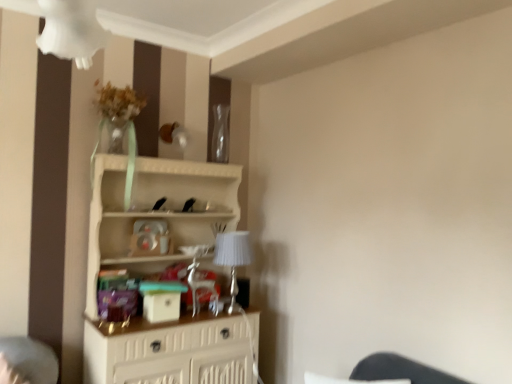
Image resolution: width=512 pixels, height=384 pixels. What are the coordinates of `transparent glass vase at upper center` in the screenshot? It's located at pos(220,134).

Where is `silver metallic table lamp at center`? Image resolution: width=512 pixels, height=384 pixels. silver metallic table lamp at center is located at coordinates (233, 258).

Find the location of a particular element. Image resolution: width=512 pixels, height=384 pixels. white wood shelf at center is located at coordinates (155, 212).

Is silver metallic table lamp at center placed right next to white wood shelf at center?

There is a gap between silver metallic table lamp at center and white wood shelf at center.

How many degrees apart are the facing directions of silver metallic table lamp at center and white wood shelf at center?

The angle between the facing direction of silver metallic table lamp at center and the facing direction of white wood shelf at center is 0.000939 degrees.

Looking at this image, from the image's perspective, which one is positioned lower, silver metallic table lamp at center or white wood shelf at center?

white wood shelf at center, from the image's perspective.

From a real-world perspective, is silver metallic table lamp at center on top of white wood shelf at center?

Yes, from a real-world perspective, silver metallic table lamp at center is above white wood shelf at center.

Does transparent glass vase at upper center appear on the left side of white wood shelf at center?

No.

Are transparent glass vase at upper center and white wood shelf at center making contact?

No, transparent glass vase at upper center is not with white wood shelf at center.

Does point (221, 121) come behind point (182, 173)?

Yes, point (221, 121) is behind point (182, 173).

From the image's perspective, is transparent glass vase at upper center located above or below white wood shelf at center?

Clearly, from the image's perspective, transparent glass vase at upper center is above white wood shelf at center.

Looking at this image, is white wood shelf at center touching transparent glass vase at upper center?

No, white wood shelf at center is not beside transparent glass vase at upper center.

Is white wood shelf at center positioned with its back to transparent glass vase at upper center?

No.

Considering the points (111, 242) and (227, 132), which point is in front, point (111, 242) or point (227, 132)?

The point (111, 242) is in front.

Which of these two, silver metallic table lamp at center or transparent glass vase at upper center, is smaller?

transparent glass vase at upper center.

Could you tell me if silver metallic table lamp at center is facing transparent glass vase at upper center?

No, silver metallic table lamp at center is not oriented towards transparent glass vase at upper center.

Is silver metallic table lamp at center surrounding transparent glass vase at upper center?

That's incorrect, transparent glass vase at upper center is not inside silver metallic table lamp at center.

In the scene shown: Does silver metallic table lamp at center appear on the right side of transparent glass vase at upper center?

Indeed, silver metallic table lamp at center is positioned on the right side of transparent glass vase at upper center.

In the scene shown: Visually, is white wood shelf at center positioned to the left or to the right of silver metallic table lamp at center?

white wood shelf at center is positioned on silver metallic table lamp at center's left side.

Does point (93, 191) come behind point (230, 242)?

No.

Is white wood shelf at center not near silver metallic table lamp at center?

No, white wood shelf at center is in close proximity to silver metallic table lamp at center.

Looking at this image, considering the relative sizes of white wood shelf at center and silver metallic table lamp at center in the image provided, is white wood shelf at center shorter than silver metallic table lamp at center?

In fact, white wood shelf at center may be taller than silver metallic table lamp at center.

In terms of height, does transparent glass vase at upper center look taller or shorter compared to silver metallic table lamp at center?

In the image, transparent glass vase at upper center appears to be shorter than silver metallic table lamp at center.

From the image's perspective, which object appears higher, transparent glass vase at upper center or silver metallic table lamp at center?

transparent glass vase at upper center appears higher in the image.

From a real-world perspective, which is physically above, transparent glass vase at upper center or silver metallic table lamp at center?

transparent glass vase at upper center, from a real-world perspective.

Measure the distance between transparent glass vase at upper center and silver metallic table lamp at center.

transparent glass vase at upper center and silver metallic table lamp at center are 79.70 centimeters apart.

The image size is (512, 384). I want to click on table lamp behind the white wood shelf at center, so click(x=233, y=258).

In the image, there is a transparent glass vase at upper center. At what (x,y) coordinates should I click in order to perform the action: click on shelf below it (from a real-world perspective). Please return your answer as a coordinate pair (x, y). Looking at the image, I should click on (155, 212).

In the scene shown: Looking at the image, which one is located closer to transparent glass vase at upper center, silver metallic table lamp at center or white wood shelf at center?

Among the two, white wood shelf at center is located nearer to transparent glass vase at upper center.

Estimate the real-world distances between objects in this image. Which object is closer to transparent glass vase at upper center, white wood shelf at center or silver metallic table lamp at center?

Based on the image, white wood shelf at center appears to be nearer to transparent glass vase at upper center.

Considering their positions, is transparent glass vase at upper center positioned closer to white wood shelf at center than silver metallic table lamp at center?

Based on the image, silver metallic table lamp at center appears to be nearer to white wood shelf at center.

Considering their positions, is transparent glass vase at upper center positioned closer to silver metallic table lamp at center than white wood shelf at center?

white wood shelf at center.

Based on their spatial positions, is silver metallic table lamp at center or transparent glass vase at upper center further from white wood shelf at center?

Based on the image, transparent glass vase at upper center appears to be further to white wood shelf at center.

Considering their positions, is white wood shelf at center positioned further to silver metallic table lamp at center than transparent glass vase at upper center?

transparent glass vase at upper center lies further to silver metallic table lamp at center than the other object.

At what (x,y) coordinates should I click in order to perform the action: click on table lamp that lies between transparent glass vase at upper center and white wood shelf at center from top to bottom. Please return your answer as a coordinate pair (x, y). Looking at the image, I should click on (233, 258).